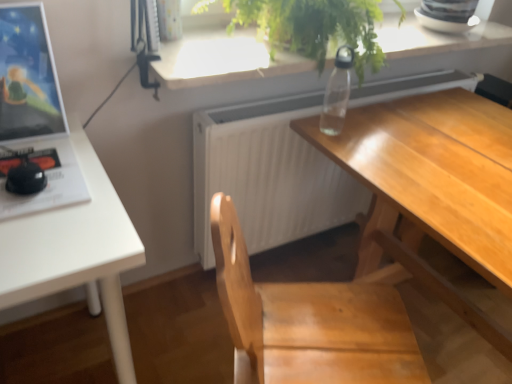
Question: Does white matte radiator at center contain white matte table at left?

Choices:
 (A) yes
 (B) no

Answer: (B)

Question: Considering the relative positions of white matte radiator at center and white matte table at left in the image provided, is white matte radiator at center to the left of white matte table at left from the viewer's perspective?

Choices:
 (A) yes
 (B) no

Answer: (B)

Question: From a real-world perspective, is white matte radiator at center located beneath white matte table at left?

Choices:
 (A) yes
 (B) no

Answer: (B)

Question: Is white matte radiator at center outside of white matte table at left?

Choices:
 (A) no
 (B) yes

Answer: (B)

Question: Is white matte radiator at center at the right side of white matte table at left?

Choices:
 (A) yes
 (B) no

Answer: (A)

Question: Considering the positions of green leafy plant at upper center and matte black monitor at left in the image, is green leafy plant at upper center bigger or smaller than matte black monitor at left?

Choices:
 (A) small
 (B) big

Answer: (B)

Question: Visually, is green leafy plant at upper center positioned to the left or to the right of matte black monitor at left?

Choices:
 (A) left
 (B) right

Answer: (B)

Question: Looking at their shapes, would you say green leafy plant at upper center is wider or thinner than matte black monitor at left?

Choices:
 (A) thin
 (B) wide

Answer: (B)

Question: Is green leafy plant at upper center in front of or behind matte black monitor at left in the image?

Choices:
 (A) front
 (B) behind

Answer: (B)

Question: Based on their positions, is white matte radiator at center located to the left or right of green leafy plant at upper center?

Choices:
 (A) left
 (B) right

Answer: (B)

Question: In terms of size, does white matte radiator at center appear bigger or smaller than green leafy plant at upper center?

Choices:
 (A) small
 (B) big

Answer: (B)

Question: Is point 314,147 closer or farther from the camera than point 325,56?

Choices:
 (A) farther
 (B) closer

Answer: (A)

Question: From the image's perspective, is white matte radiator at center located above or below green leafy plant at upper center?

Choices:
 (A) above
 (B) below

Answer: (B)

Question: From the image's perspective, is white matte table at left positioned above or below wooden desk at center?

Choices:
 (A) above
 (B) below

Answer: (A)

Question: Relative to wooden desk at center, is white matte table at left in front or behind?

Choices:
 (A) front
 (B) behind

Answer: (B)